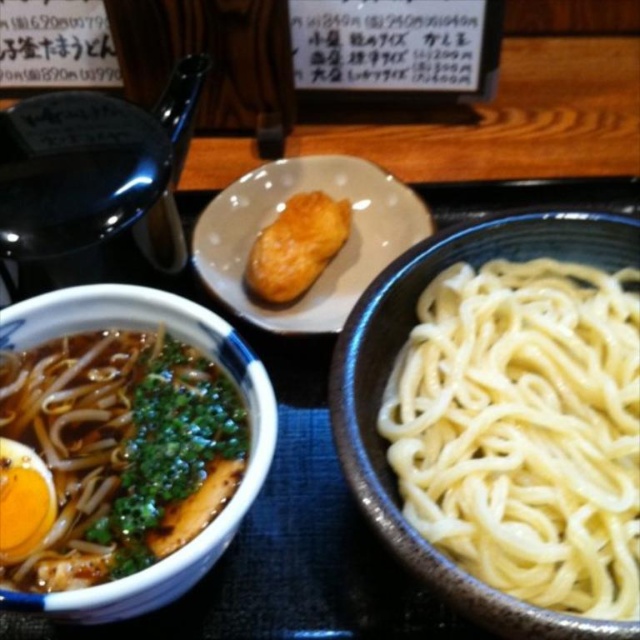
How distant is matte ceramic bowl at left from matte ceramic plate at center?

matte ceramic bowl at left is 11.79 inches from matte ceramic plate at center.

What do you see at coordinates (211, 356) in the screenshot? I see `matte ceramic bowl at left` at bounding box center [211, 356].

Where is `matte ceramic bowl at left`? matte ceramic bowl at left is located at coordinates (211, 356).

Is white matte noodles at right below golden crispy chicken at center?

Correct, white matte noodles at right is located below golden crispy chicken at center.

From the picture: Does white matte noodles at right have a smaller size compared to golden crispy chicken at center?

Incorrect, white matte noodles at right is not smaller in size than golden crispy chicken at center.

Describe the element at coordinates (524, 429) in the screenshot. I see `white matte noodles at right` at that location.

Where is `white matte noodles at right`? The image size is (640, 640). white matte noodles at right is located at coordinates (524, 429).

Who is shorter, matte ceramic plate at center or golden crispy chicken at center?

golden crispy chicken at center is shorter.

Between point (320, 173) and point (276, 275), which one is positioned in front?

Point (276, 275) is more forward.

Does point (209, 214) lie in front of point (324, 264)?

That is True.

Where is `matte ceramic plate at center`? This screenshot has width=640, height=640. matte ceramic plate at center is located at coordinates (330, 260).